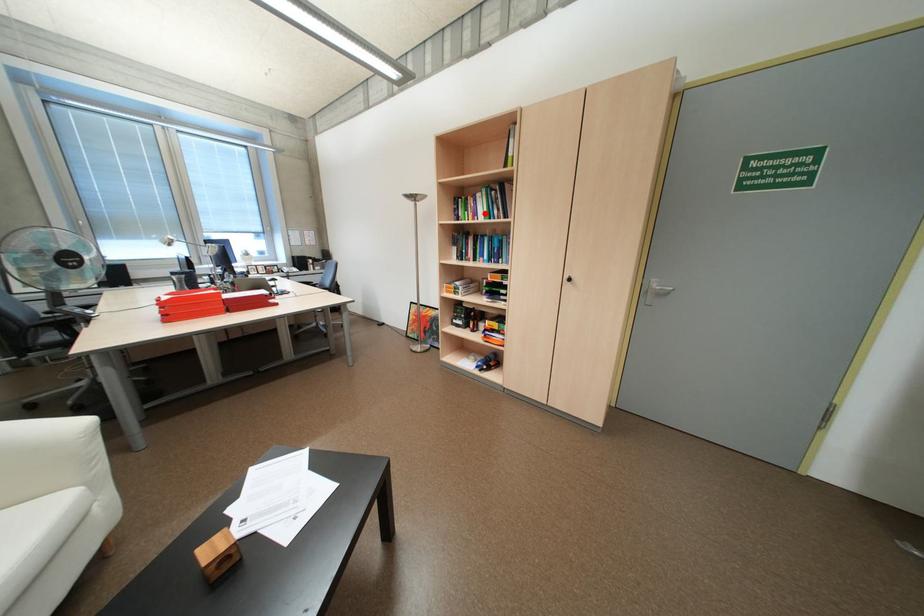
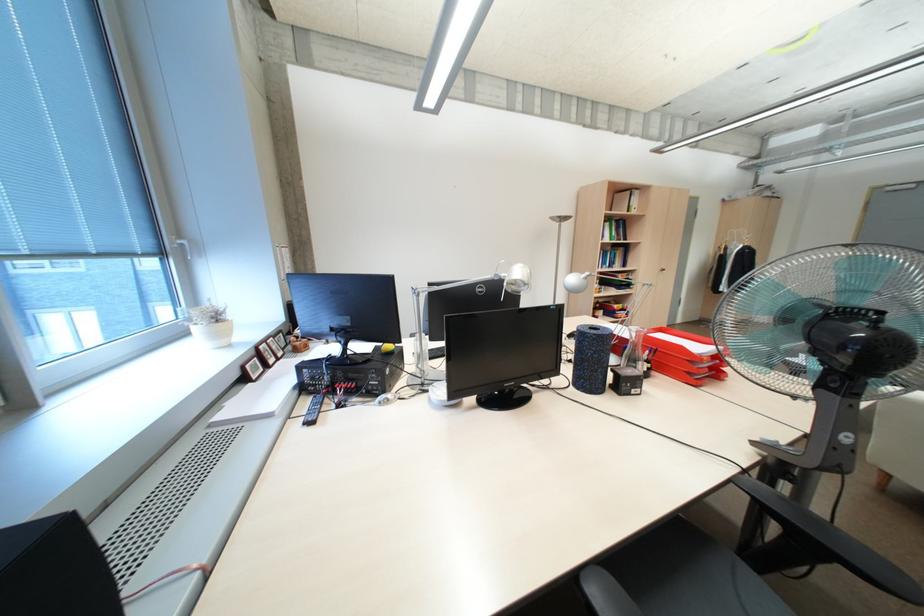
Find the pixel in the second image that matches the highlighted location in the first image.

(612, 236)